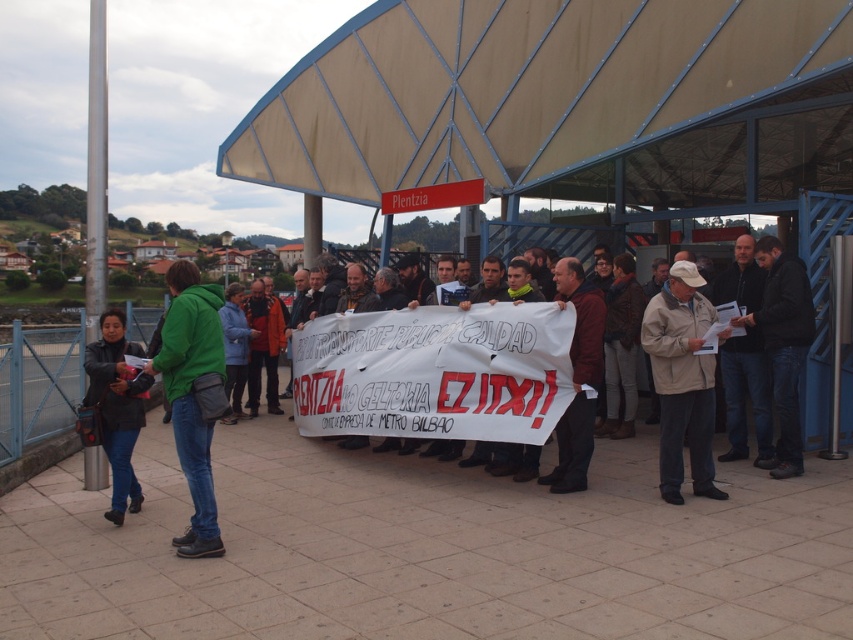
Who is positioned more to the right, beige fabric jacket at center or black leather jacket at lower left?

Positioned to the right is beige fabric jacket at center.

Consider the image. Does beige fabric jacket at center appear over black leather jacket at lower left?

Correct, beige fabric jacket at center is located above black leather jacket at lower left.

Image resolution: width=853 pixels, height=640 pixels. What are the coordinates of `beige fabric jacket at center` in the screenshot? It's located at (682, 380).

Between beige fabric jacket at center and dark blue jeans at center, which one has less height?

Standing shorter between the two is beige fabric jacket at center.

Where is `beige fabric jacket at center`? beige fabric jacket at center is located at coordinates (682, 380).

At what (x,y) coordinates should I click in order to perform the action: click on beige fabric jacket at center. Please return your answer as a coordinate pair (x, y). Image resolution: width=853 pixels, height=640 pixels. Looking at the image, I should click on (682, 380).

Who is shorter, beige fabric jacket at center or green matte jacket at left?

green matte jacket at left

Which is below, beige fabric jacket at center or green matte jacket at left?

Positioned lower is green matte jacket at left.

Find the location of a particular element. The width and height of the screenshot is (853, 640). beige fabric jacket at center is located at coordinates (682, 380).

You are a GUI agent. You are given a task and a screenshot of the screen. Output one action in this format:
    pyautogui.click(x=<x>, y=<y>)
    Task: Click on the beige fabric jacket at center
    The width and height of the screenshot is (853, 640).
    Given the screenshot: What is the action you would take?
    pyautogui.click(x=682, y=380)